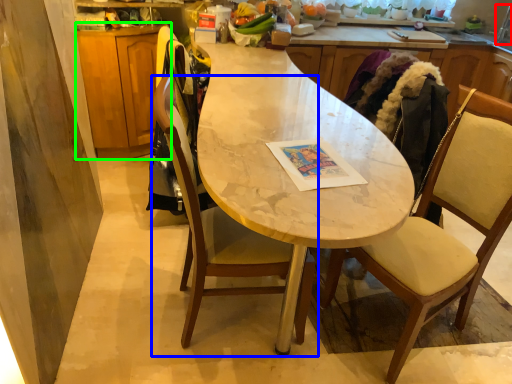
Question: Which is nearer to the faucet (highlighted by a red box)? chair (highlighted by a blue box) or cabinetry (highlighted by a green box).

Choices:
 (A) chair
 (B) cabinetry

Answer: (A)